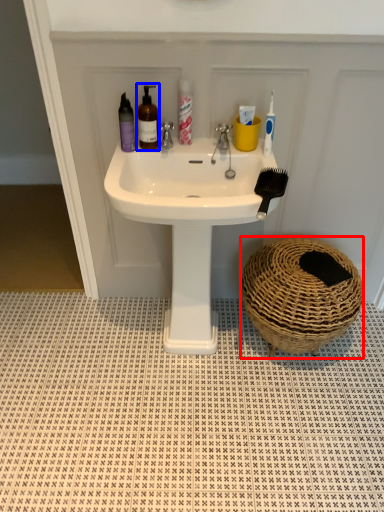
Question: Among these objects, which one is farthest to the camera, basket (highlighted by a red box) or mouthwash (highlighted by a blue box)?

Choices:
 (A) basket
 (B) mouthwash

Answer: (A)